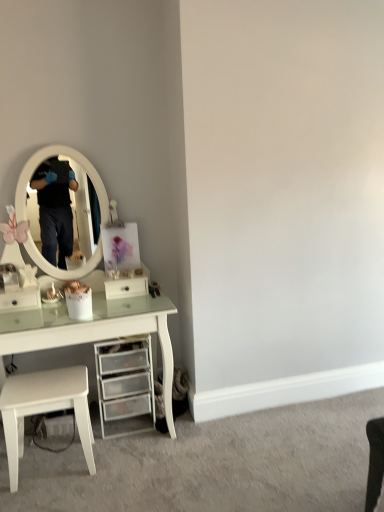
Where is `free point above white glossy drawer at left, which is the first drawer in left-to-right order (from a real-world perspective)`? Image resolution: width=384 pixels, height=512 pixels. free point above white glossy drawer at left, which is the first drawer in left-to-right order (from a real-world perspective) is located at coordinates (14, 287).